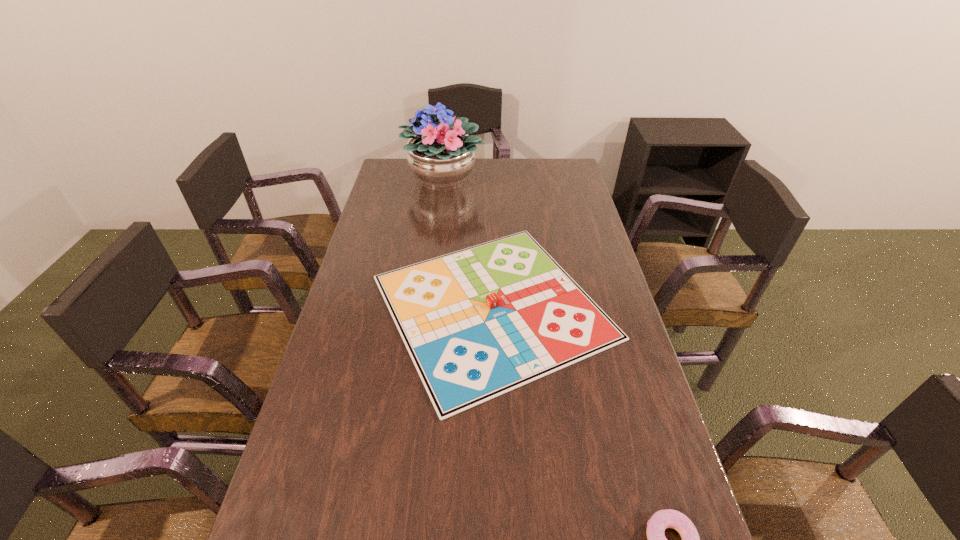
Where is `vacant space at the far edge of the desktop`? This screenshot has height=540, width=960. vacant space at the far edge of the desktop is located at coordinates (526, 163).

In the image, there is a desktop. Where is `free region at the left edge`? The height and width of the screenshot is (540, 960). free region at the left edge is located at coordinates (403, 194).

I want to click on vacant space at the right edge of the desktop, so pos(557,260).

At what (x,y) coordinates should I click in order to perform the action: click on vacant space at the far left corner. Please return your answer as a coordinate pair (x, y). The width and height of the screenshot is (960, 540). Looking at the image, I should click on (391, 183).

Locate an element on the screen. This screenshot has height=540, width=960. vacant space that's between the second farthest object and the farthest object is located at coordinates (468, 243).

Point out which object is positioned as the second nearest to the second nearest object. Please provide its 2D coordinates. Your answer should be formatted as a tuple, i.e. [(x, y)], where the tuple contains the x and y coordinates of a point satisfying the conditions above.

[(662, 519)]

This screenshot has height=540, width=960. Find the location of `object that can be found as the second closest to the bouquet`. object that can be found as the second closest to the bouquet is located at coordinates (662, 519).

You are a GUI agent. You are given a task and a screenshot of the screen. Output one action in this format:
    pyautogui.click(x=<x>, y=<y>)
    Task: Click on the vacant space that satisfies the following two spatial constraints: 1. on the front side of the gameboard; 2. on the left side of the bouquet
    The height and width of the screenshot is (540, 960).
    Given the screenshot: What is the action you would take?
    pyautogui.click(x=427, y=307)